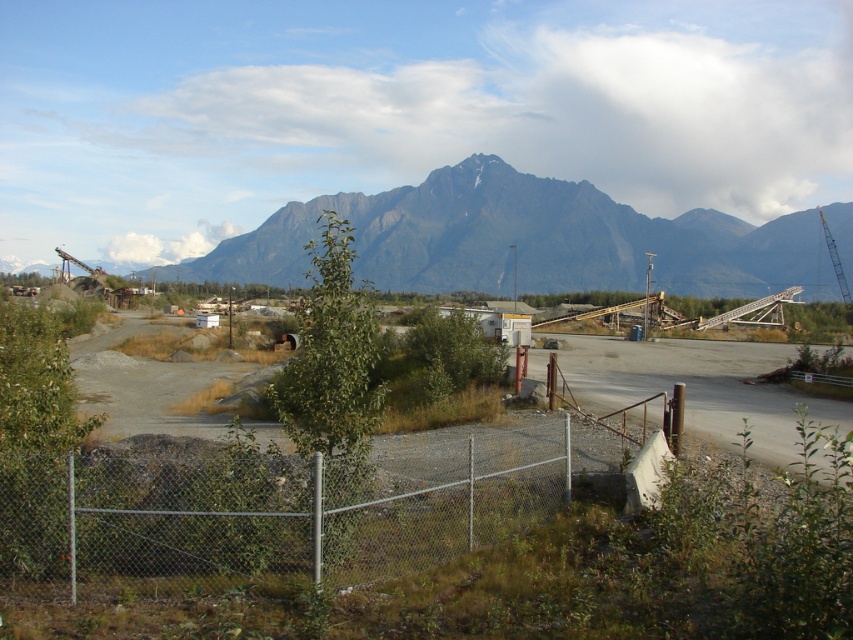
Who is positioned more to the left, metallic gravel at center or metal chain-link fence at lower center?

From the viewer's perspective, metallic gravel at center appears more on the left side.

How much distance is there between metallic gravel at center and metal chain-link fence at lower center?

metallic gravel at center is 1.65 meters from metal chain-link fence at lower center.

The width and height of the screenshot is (853, 640). Identify the location of metallic gravel at center. tap(282, 508).

I want to click on metallic gravel at center, so click(x=282, y=508).